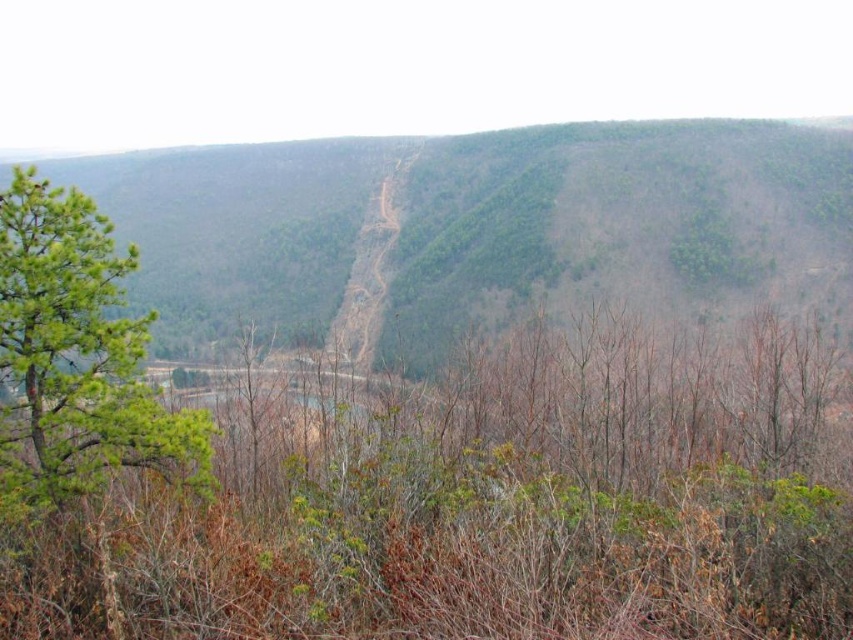
What is the 2D coordinate of the green leafy hillside at center?

The green leafy hillside at center is located at the 2D coordinate point of (476, 228).